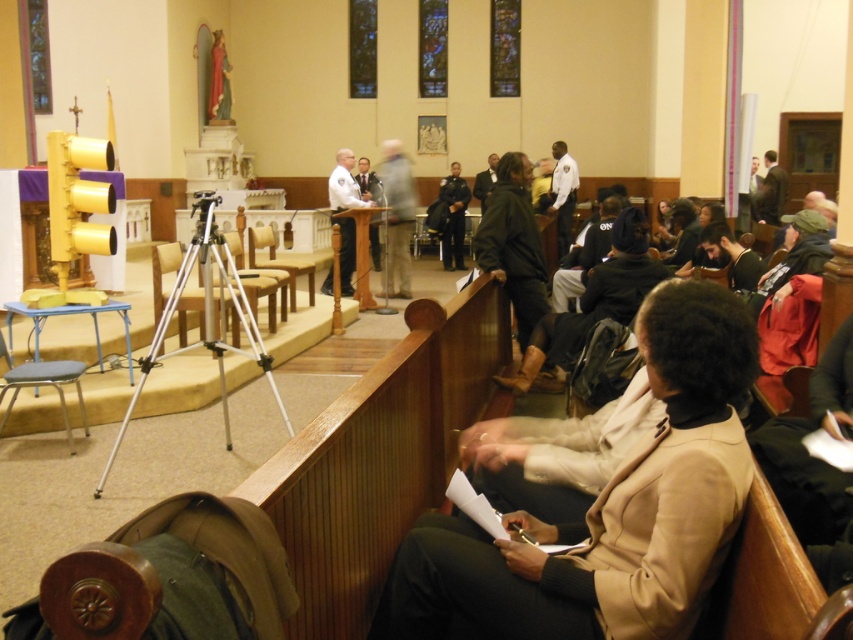
How far apart are dark brown leather jacket at center and white uniform at center?

3.37 meters

The width and height of the screenshot is (853, 640). Describe the element at coordinates (514, 244) in the screenshot. I see `dark brown leather jacket at center` at that location.

Does point (497, 208) lie behind point (346, 250)?

No, (497, 208) is in front of (346, 250).

Identify the location of dark brown leather jacket at center. The height and width of the screenshot is (640, 853). pos(514,244).

Is beige wool coat at center to the right of dark brown leather jacket at center from the viewer's perspective?

No, beige wool coat at center is not to the right of dark brown leather jacket at center.

Who is more distant from viewer, [613,547] or [474,237]?

Point [474,237]

Locate an element on the screen. The image size is (853, 640). beige wool coat at center is located at coordinates (607, 509).

Does point (345, 198) come closer to viewer compared to point (374, 260)?

Yes, it is.

Who is more forward, (x=329, y=180) or (x=364, y=170)?

Point (x=329, y=180) is in front.

Is point (343, 195) farther from viewer compared to point (361, 177)?

That is False.

This screenshot has width=853, height=640. I want to click on white uniform at center, so click(x=345, y=184).